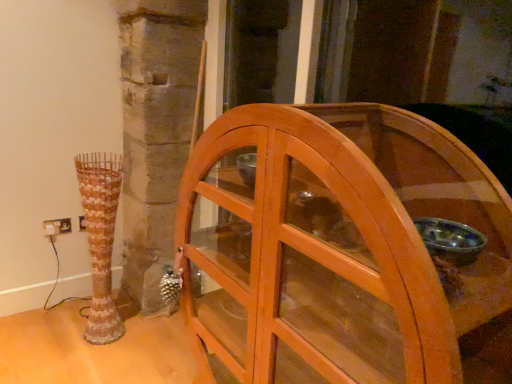
Locate an element on the screen. This screenshot has width=512, height=384. spots to the right of rustic ceramic vase at left is located at coordinates (145, 338).